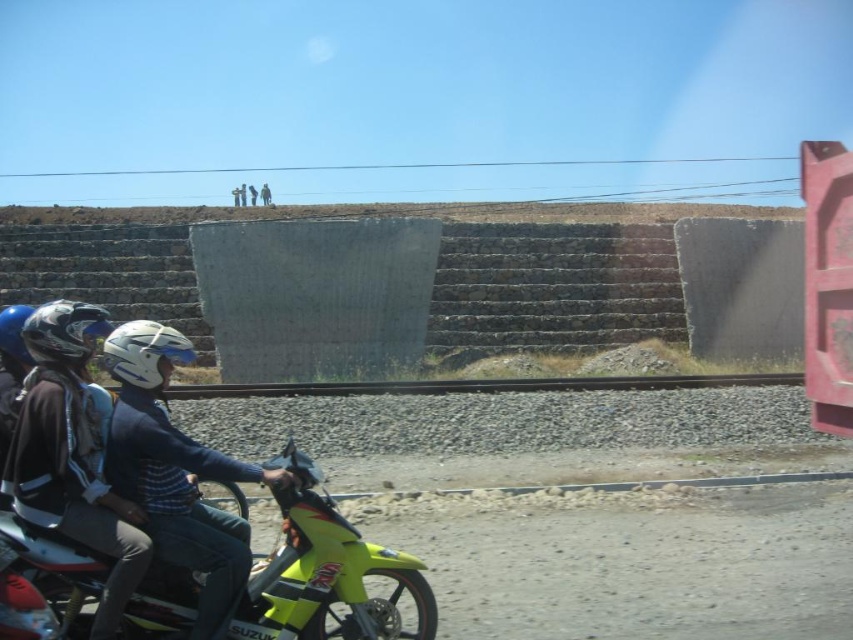
Question: Is neon yellow plastic motorcycle at lower left to the left of matte black helmet at left from the viewer's perspective?

Choices:
 (A) yes
 (B) no

Answer: (B)

Question: Among these objects, which one is farthest from the camera?

Choices:
 (A) white matte helmet at center
 (B) neon yellow plastic motorcycle at lower left
 (C) blue matte helmet at left
 (D) matte black motorcycle at lower left

Answer: (C)

Question: Is matte black helmet at left above white matte helmet at center?

Choices:
 (A) no
 (B) yes

Answer: (B)

Question: Which point is closer to the camera?

Choices:
 (A) neon yellow plastic motorcycle at lower left
 (B) matte black motorcycle at lower left
 (C) white matte helmet at center

Answer: (B)

Question: Is neon yellow plastic motorcycle at lower left bigger than matte black helmet at left?

Choices:
 (A) yes
 (B) no

Answer: (B)

Question: Among these points, which one is nearest to the camera?

Choices:
 (A) (85, 305)
 (B) (134, 525)

Answer: (B)